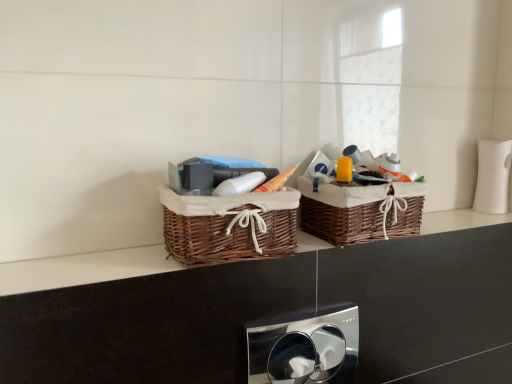
This screenshot has height=384, width=512. I want to click on vacant region to the left of woven brown basket at center, which appears as the 2th picnic basket when viewed from the right, so (123, 264).